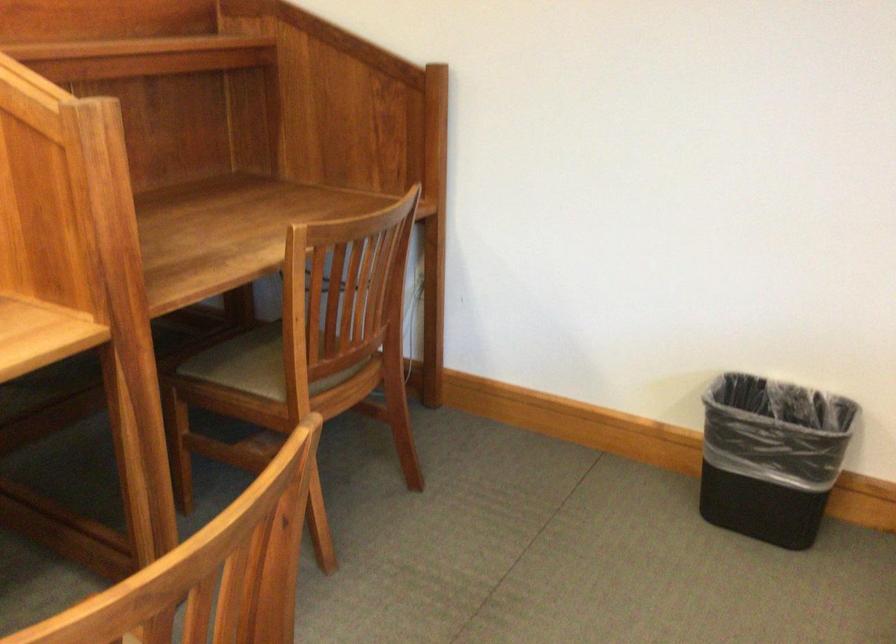
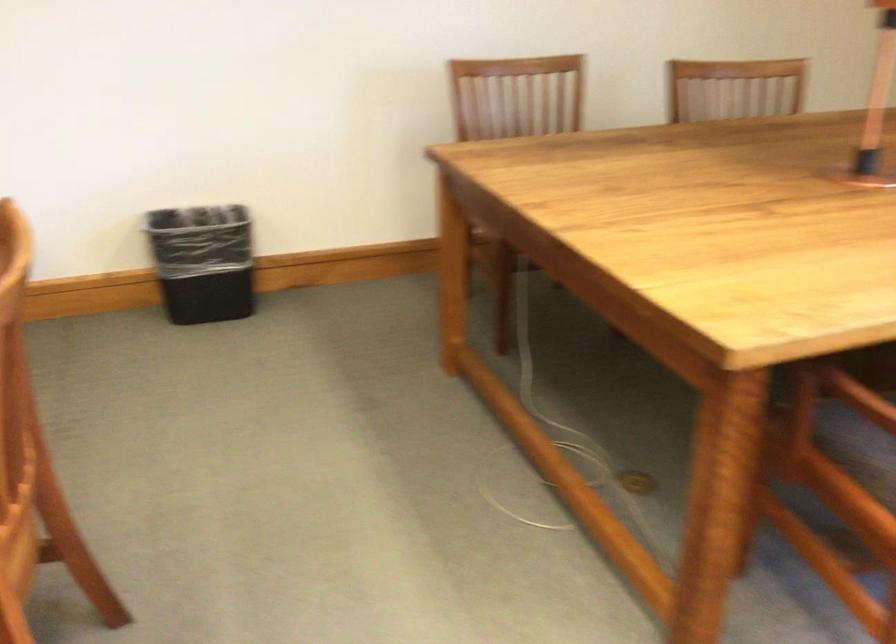
Question: The camera is either moving clockwise (left) or counter-clockwise (right) around the object. The first image is from the beginning of the video and the second image is from the end. Is the camera moving left or right when shooting the video?

Choices:
 (A) Left
 (B) Right

Answer: (A)